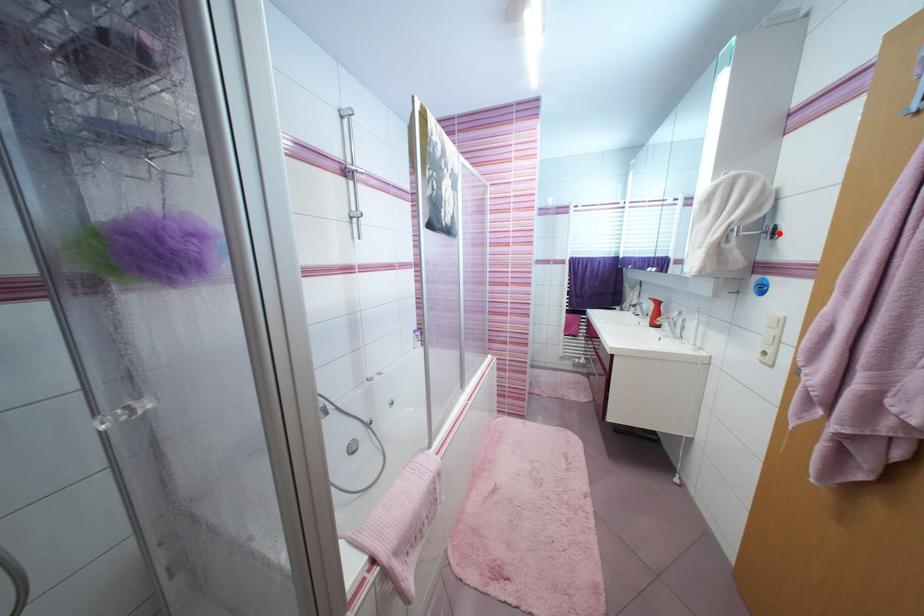
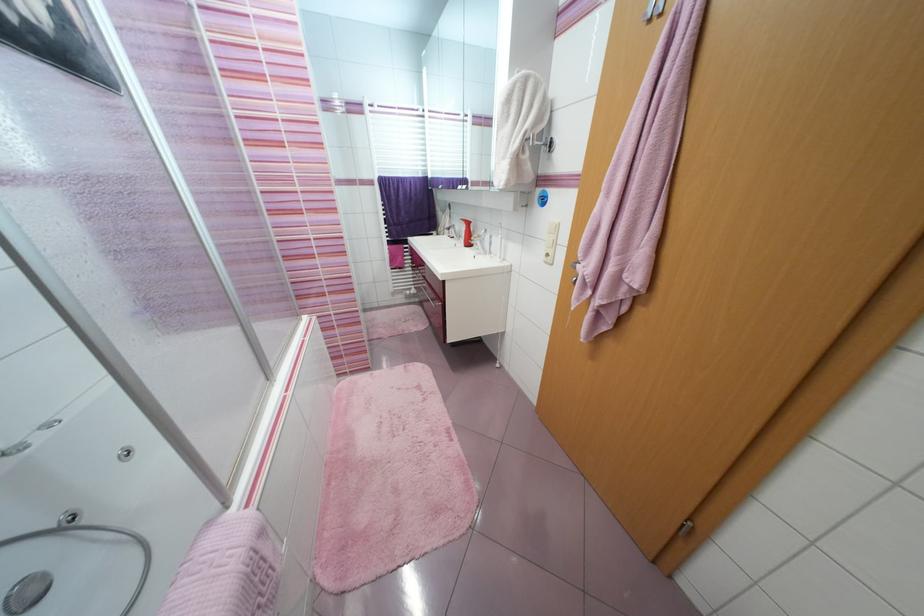
The point at the highlighted location is marked in the first image. Where is the corresponding point in the second image?

(555, 147)